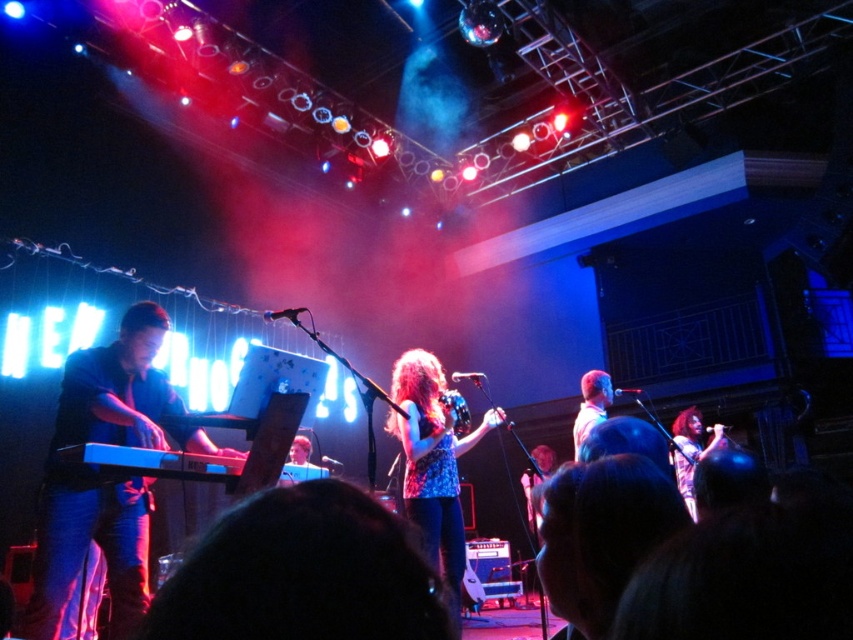
You are a photographer standing at the back of the venue. You want to take a photo of the blue denim jeans at left. Where should you aim your camera to capture them in the frame?

You should aim your camera at the point (105,476) to capture the blue denim jeans at left in the frame.